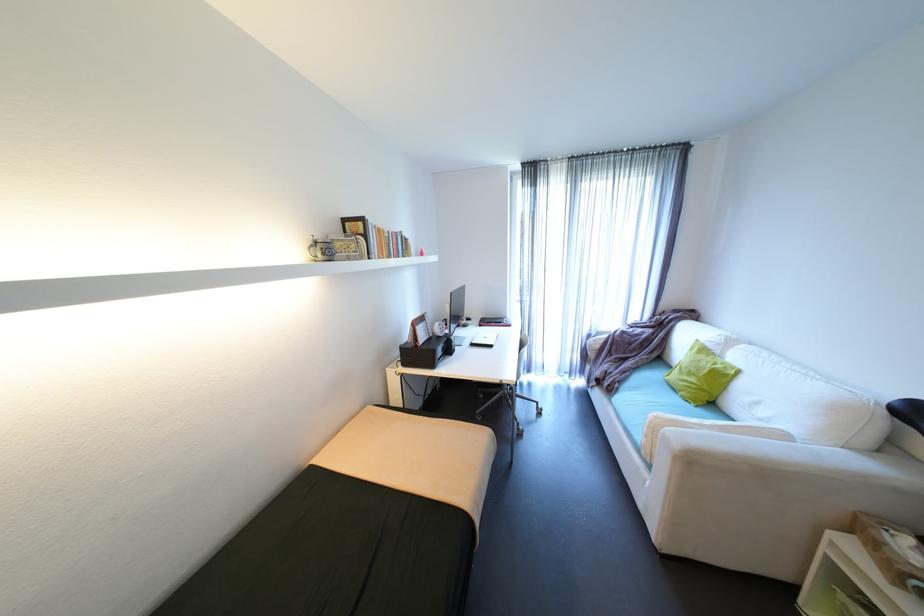
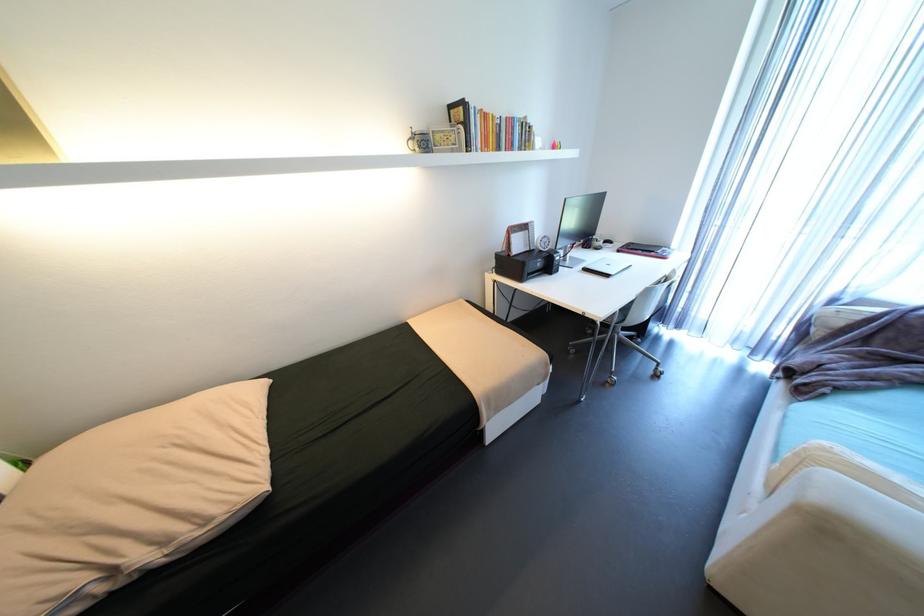
How did the camera likely rotate?

The camera rotated toward left-down.